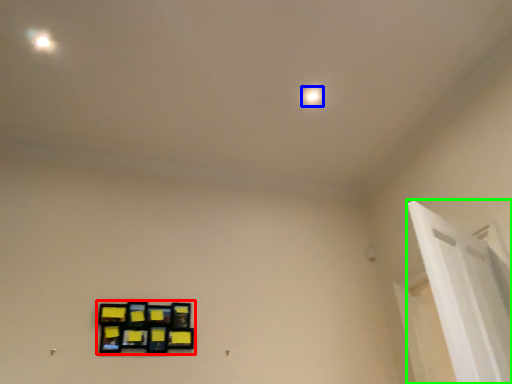
Question: Estimate the real-world distances between objects in this image. Which object is closer to picture frame (highlighted by a red box), dot (highlighted by a blue box) or window frame (highlighted by a green box)?

Choices:
 (A) dot
 (B) window frame

Answer: (B)